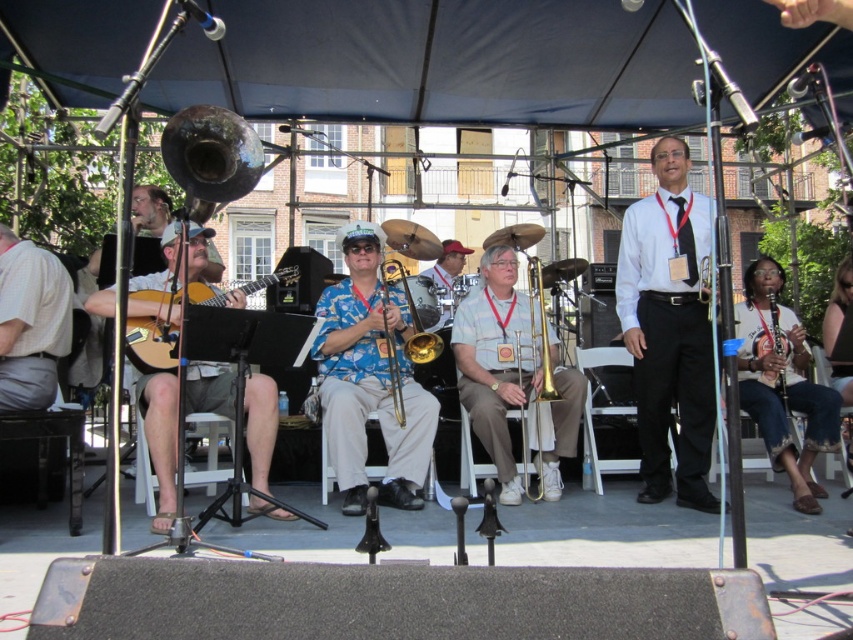
You are a photographer standing behind the stage. You need to capture a clear photo of both the blue floral shirt at center and the gold shiny trombone at center. Based on their positions, which object will appear closer to the camera in the photo?

The blue floral shirt at center is positioned over the gold shiny trombone at center, so in the photo, the blue floral shirt at center will appear closer to the camera than the gold shiny trombone at center.

You are a photographer taking a picture of the gold shiny trombone at center and the gold brass trumpet at center. Which one should you focus on first if you want to capture the one that is more to the right?

The gold shiny trombone at center is positioned on the right side of gold brass trumpet at center, so you should focus on the gold shiny trombone at center first to capture the one more to the right.

You are a stagehand responsible for arranging the musical instruments after the performance. You need to place the gold shiny trombone at center and the gold brass trumpet at center into storage. Which instrument will require a larger storage space?

The gold shiny trombone at center requires a larger storage space because it has a larger size compared to the gold brass trumpet at center.